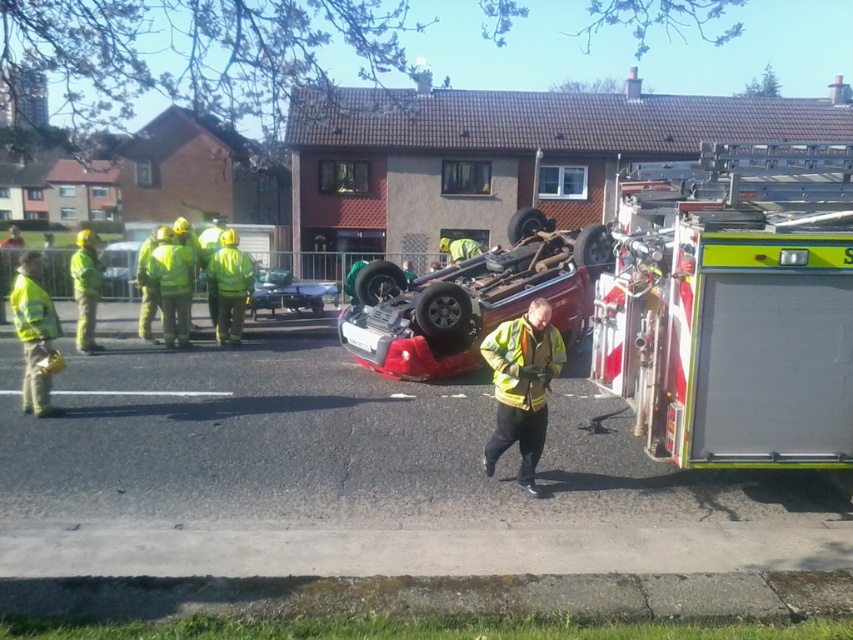
Between yellow reflective jacket at center and metallic green car at center, which one is positioned lower?

yellow reflective jacket at center

Between yellow reflective jacket at center and metallic green car at center, which one has more height?

With more height is yellow reflective jacket at center.

This screenshot has width=853, height=640. What do you see at coordinates (521, 387) in the screenshot?
I see `yellow reflective jacket at center` at bounding box center [521, 387].

This screenshot has height=640, width=853. In order to click on yellow reflective jacket at center in this screenshot , I will do `click(521, 387)`.

Is white metallic fire truck at right shorter than high-visibility reflective jacket at center?

Indeed, white metallic fire truck at right has a lesser height compared to high-visibility reflective jacket at center.

Describe the element at coordinates (733, 307) in the screenshot. This screenshot has width=853, height=640. I see `white metallic fire truck at right` at that location.

This screenshot has height=640, width=853. I want to click on white metallic fire truck at right, so click(x=733, y=307).

Which is in front, point (752, 440) or point (105, 252)?

Positioned in front is point (752, 440).

Who is positioned more to the right, white metallic fire truck at right or metallic silver car at center?

white metallic fire truck at right is more to the right.

Does point (851, 339) lie in front of point (109, 276)?

That is True.

Image resolution: width=853 pixels, height=640 pixels. Find the location of `white metallic fire truck at right`. white metallic fire truck at right is located at coordinates (733, 307).